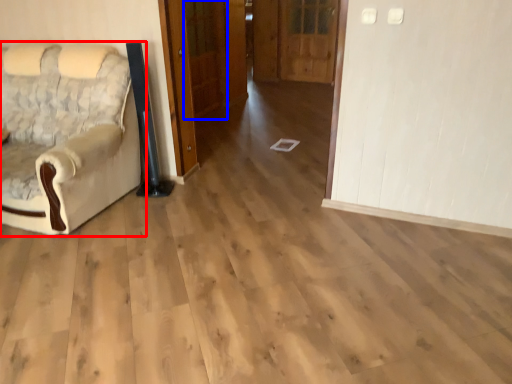
Question: Which object is further to the camera taking this photo, chair (highlighted by a red box) or door (highlighted by a blue box)?

Choices:
 (A) chair
 (B) door

Answer: (B)